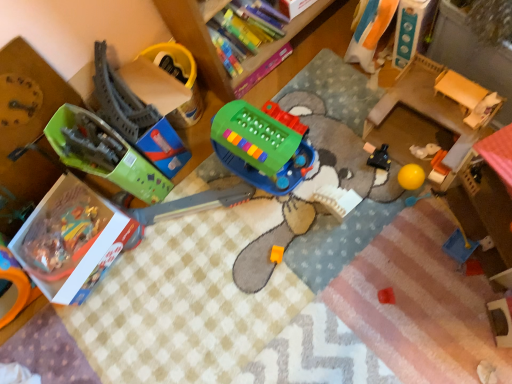
I want to click on vacant area to the right of green plastic toy at center, placed as the third toy when sorted from left to right, so click(x=331, y=120).